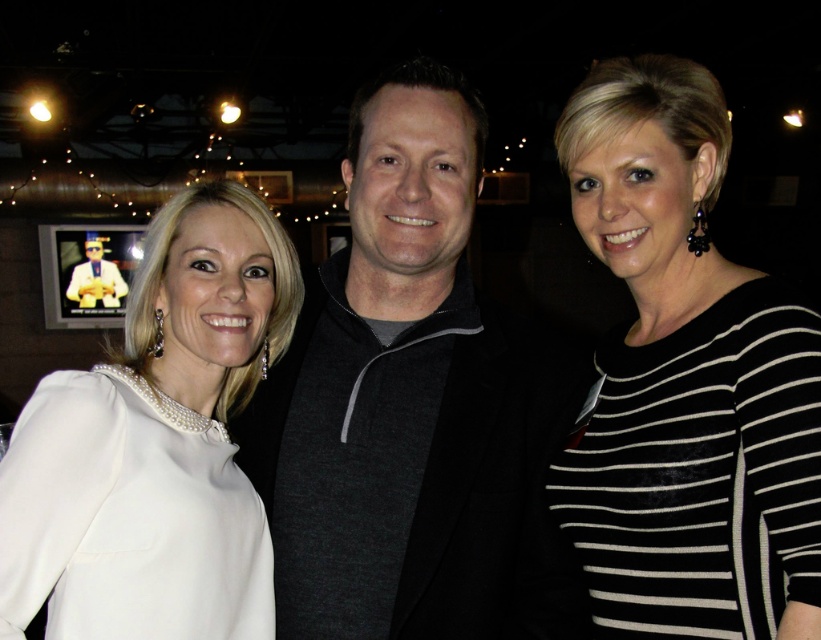
Question: Does dark gray sweater at center appear under matte black suit at center?

Choices:
 (A) no
 (B) yes

Answer: (B)

Question: Which object appears closest to the camera in this image?

Choices:
 (A) dark gray sweater at center
 (B) white satin dress at center
 (C) matte black suit at center

Answer: (B)

Question: Which point is closer to the camera?

Choices:
 (A) (108, 280)
 (B) (700, 515)
 (C) (432, 76)

Answer: (B)

Question: Is black striped shirt at center to the left of matte black suit at center from the viewer's perspective?

Choices:
 (A) yes
 (B) no

Answer: (B)

Question: Is dark gray sweater at center behind black striped shirt at center?

Choices:
 (A) no
 (B) yes

Answer: (B)

Question: Which object is closer to the camera taking this photo?

Choices:
 (A) dark gray sweater at center
 (B) black striped shirt at center
 (C) matte black suit at center
 (D) white satin dress at center

Answer: (B)